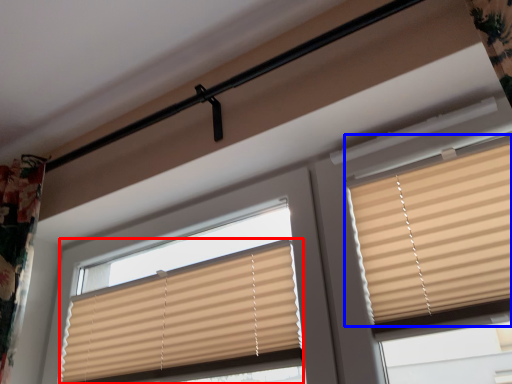
Question: Which object appears farthest to the camera in this image, window blind (highlighted by a red box) or window blind (highlighted by a blue box)?

Choices:
 (A) window blind
 (B) window blind

Answer: (A)